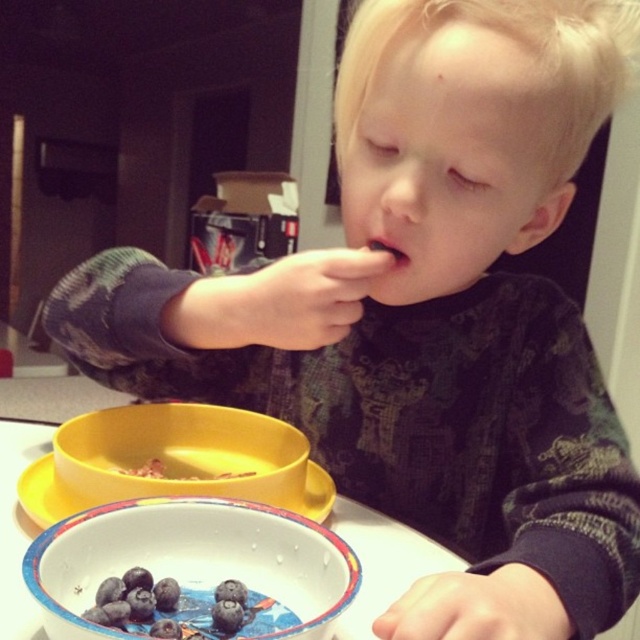
You are a parent trying to clean up after your child. You need to stack the yellow plastic bowl at center and the white glossy plate at lower center. Which one should you place on top to ensure stability?

The yellow plastic bowl at center is taller than the white glossy plate at lower center, so placing the shorter plate on top of the taller bowl would provide better stability.

What is the exact location of the blue glossy bowl at lower center in the image?

The blue glossy bowl at lower center is located at point coordinates of 0.880 on the x axis and 0.305 on the y axis.

Looking at this image, the child is trying to drink milk from the blue glossy bowl at lower center. However, their mouth is covered by smooth skin at mouth center. Can they reach the bowl without moving their mouth?

The blue glossy bowl at lower center is taller than the smooth skin at mouth center, so the child can reach the bowl without moving their mouth as the bowl is higher up.